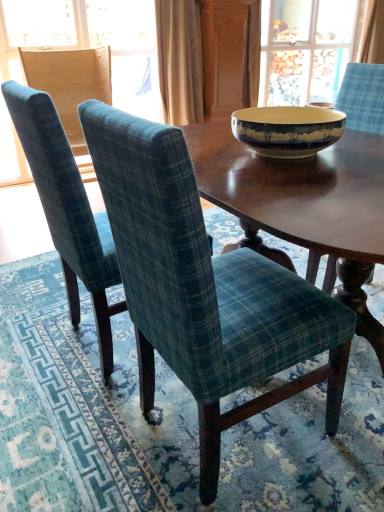
Question: Is teal plaid chair at center, the 2th chair viewed from the left, beside wooden screen door at upper center?

Choices:
 (A) yes
 (B) no

Answer: (B)

Question: Is teal plaid chair at center, the 2th chair viewed from the left, aimed at wooden screen door at upper center?

Choices:
 (A) yes
 (B) no

Answer: (B)

Question: Does teal plaid chair at center, which is the 2th chair in right-to-left order, have a smaller size compared to wooden screen door at upper center?

Choices:
 (A) yes
 (B) no

Answer: (B)

Question: Is the depth of teal plaid chair at center, the 2th chair viewed from the left, greater than that of wooden screen door at upper center?

Choices:
 (A) no
 (B) yes

Answer: (A)

Question: Can you confirm if teal plaid chair at center, which is the 2th chair in right-to-left order, is positioned to the left of wooden screen door at upper center?

Choices:
 (A) yes
 (B) no

Answer: (A)

Question: In terms of size, does teal plaid chair at left, arranged as the first chair when viewed from the left, appear bigger or smaller than green plaid fabric chair at center, which appears as the first chair when viewed from the right?

Choices:
 (A) small
 (B) big

Answer: (A)

Question: From the image's perspective, is teal plaid chair at left, the 3th chair when ordered from right to left, positioned above or below green plaid fabric chair at center, the third chair when ordered from left to right?

Choices:
 (A) above
 (B) below

Answer: (A)

Question: In the image, is teal plaid chair at left, the 3th chair when ordered from right to left, on the left side or the right side of green plaid fabric chair at center, which appears as the first chair when viewed from the right?

Choices:
 (A) right
 (B) left

Answer: (B)

Question: From a real-world perspective, relative to green plaid fabric chair at center, which appears as the first chair when viewed from the right, is teal plaid chair at left, the 3th chair when ordered from right to left, vertically above or below?

Choices:
 (A) below
 (B) above

Answer: (B)

Question: Based on their sizes in the image, would you say matte ceramic bowl at center is bigger or smaller than teal plaid chair at left, the 3th chair when ordered from right to left?

Choices:
 (A) big
 (B) small

Answer: (B)

Question: In the image, is matte ceramic bowl at center on the left side or the right side of teal plaid chair at left, arranged as the first chair when viewed from the left?

Choices:
 (A) left
 (B) right

Answer: (B)

Question: Do you think matte ceramic bowl at center is within teal plaid chair at left, the 3th chair when ordered from right to left, or outside of it?

Choices:
 (A) outside
 (B) inside

Answer: (A)

Question: From a real-world perspective, is matte ceramic bowl at center above or below teal plaid chair at left, the 3th chair when ordered from right to left?

Choices:
 (A) below
 (B) above

Answer: (A)

Question: Considering the positions of matte ceramic bowl at center and beige fabric curtain at upper center, the second curtain viewed from the back, in the image, is matte ceramic bowl at center taller or shorter than beige fabric curtain at upper center, the second curtain viewed from the back,?

Choices:
 (A) tall
 (B) short

Answer: (B)

Question: From the image's perspective, relative to beige fabric curtain at upper center, arranged as the second curtain when viewed from the right, is matte ceramic bowl at center above or below?

Choices:
 (A) below
 (B) above

Answer: (A)